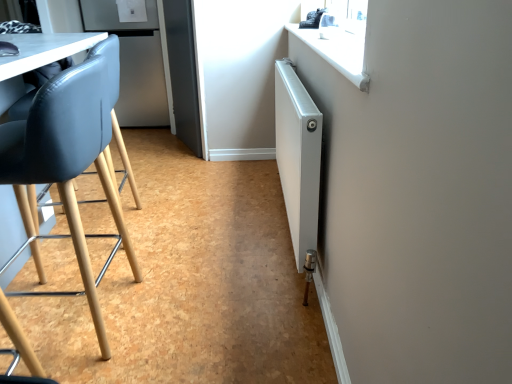
Locate an element on the screen. Image resolution: width=512 pixels, height=384 pixels. vacant area that lies between matte black chair at left and white metallic radiator at right is located at coordinates (207, 259).